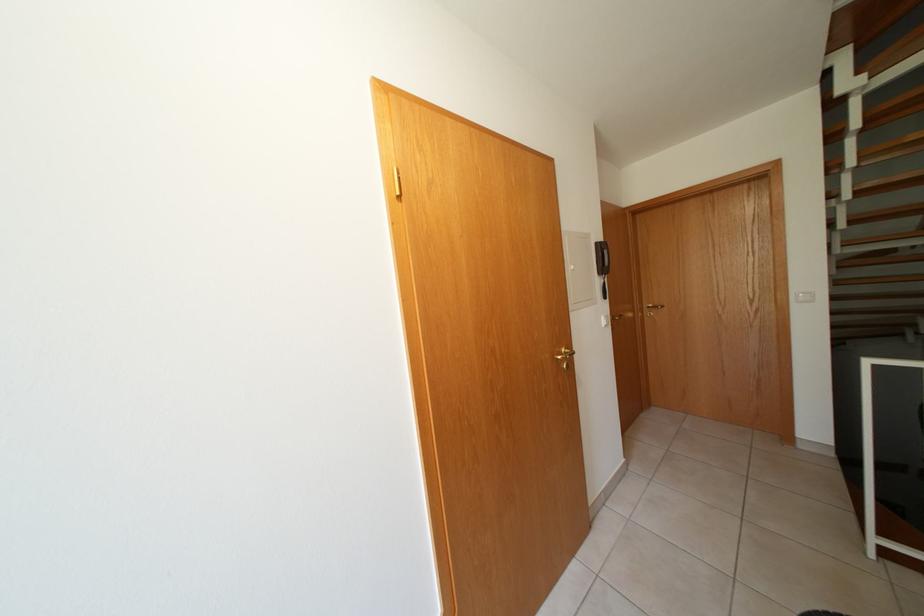
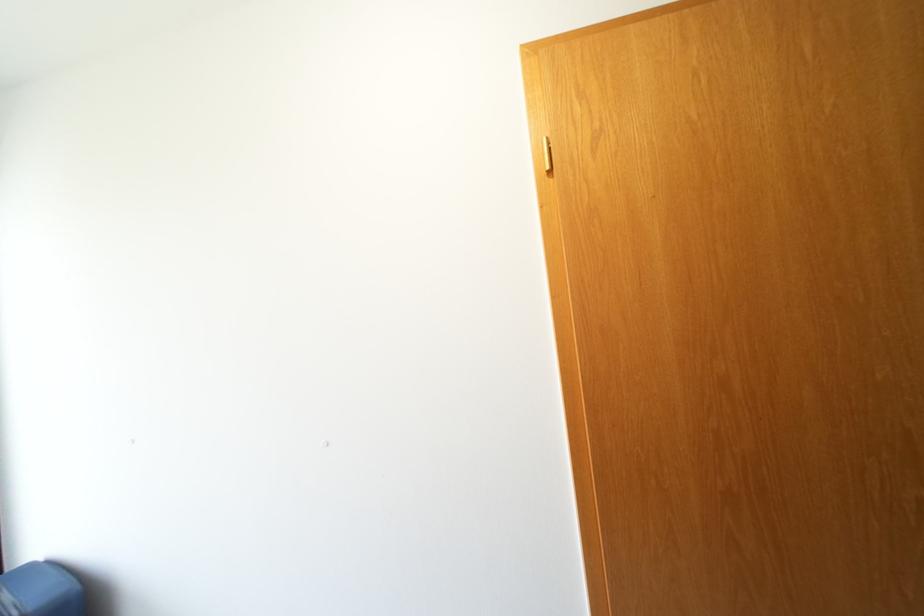
Question: The camera is either moving clockwise (left) or counter-clockwise (right) around the object. The first image is from the beginning of the video and the second image is from the end. Is the camera moving left or right when shooting the video?

Choices:
 (A) Left
 (B) Right

Answer: (B)